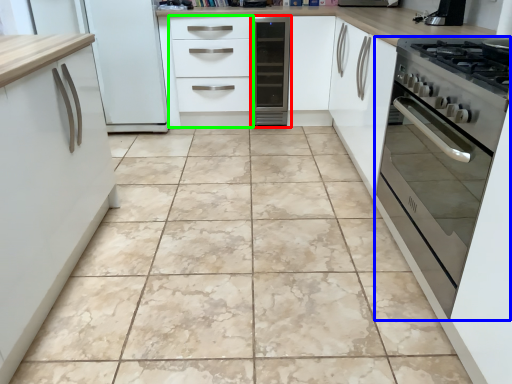
Question: Which object is positioned farthest from home appliance (highlighted by a red box)? Select from oven (highlighted by a blue box) and drawer (highlighted by a green box).

Choices:
 (A) oven
 (B) drawer

Answer: (A)